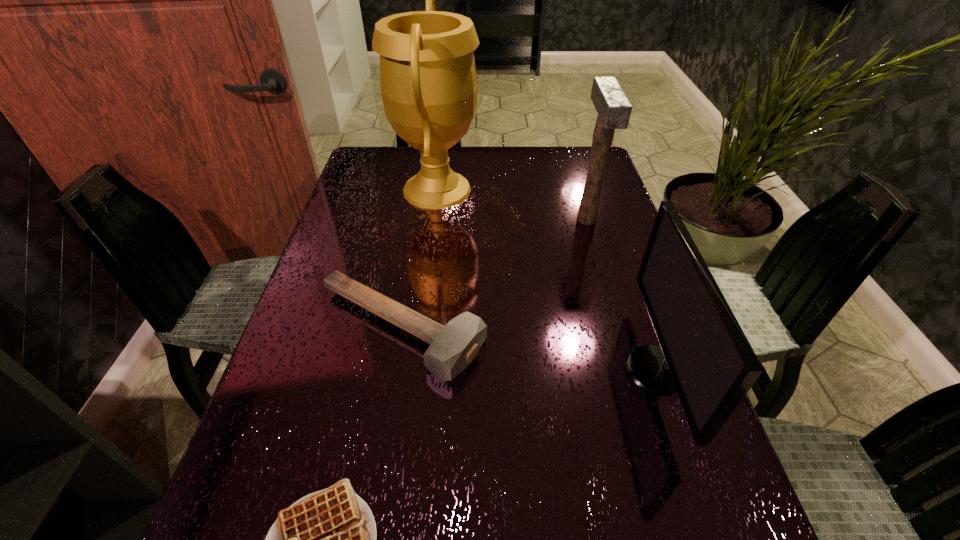
Where is `vacant space at the right edge`? vacant space at the right edge is located at coordinates (619, 293).

This screenshot has height=540, width=960. In the image, there is a desktop. What are the coordinates of `vacant area at the far left corner` in the screenshot? It's located at (385, 165).

What are the coordinates of `free space between the tallest object and the computer monitor` in the screenshot? It's located at (545, 280).

Locate an element on the screen. free point between the tallest object and the shorter mallet is located at coordinates (420, 259).

Image resolution: width=960 pixels, height=540 pixels. Find the location of `vacant region between the shorter mallet and the right mallet`. vacant region between the shorter mallet and the right mallet is located at coordinates (493, 274).

This screenshot has height=540, width=960. In order to click on blank region between the computer monitor and the right mallet in this screenshot , I will do `click(620, 294)`.

I want to click on vacant area that lies between the computer monitor and the left mallet, so click(528, 349).

Where is `vacant area that lies between the third tallest object and the nearer mallet`? vacant area that lies between the third tallest object and the nearer mallet is located at coordinates (528, 349).

Point out which object is positioned as the third nearest to the nearest object. Please provide its 2D coordinates. Your answer should be formatted as a tuple, i.e. [(x, y)], where the tuple contains the x and y coordinates of a point satisfying the conditions above.

[(428, 81)]

I want to click on object that stands as the fourth closest to the nearer mallet, so [614, 110].